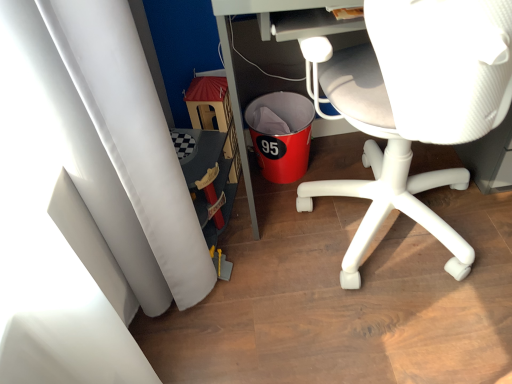
What do you see at coordinates (413, 106) in the screenshot? I see `white plastic chair at right` at bounding box center [413, 106].

Identify the location of white plastic chair at right. The image size is (512, 384). (413, 106).

This screenshot has width=512, height=384. In order to click on white plastic chair at right in this screenshot , I will do `click(413, 106)`.